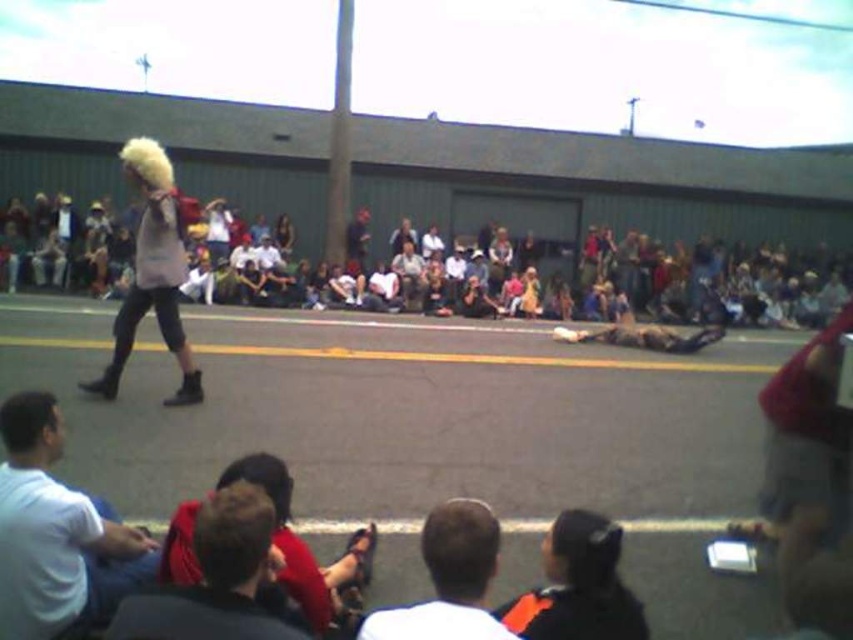
Question: Estimate the real-world distances between objects in this image. Which object is closer to the white cotton shirt at lower left?

Choices:
 (A) fuzzy wig at center
 (B) orange and black jacket at lower center
 (C) fuzzy white wig at left

Answer: (B)

Question: Which point is closer to the camera?

Choices:
 (A) fuzzy wig at center
 (B) red shirt at lower left

Answer: (B)

Question: Does orange and black jacket at lower center appear on the right side of fuzzy white wig at left?

Choices:
 (A) yes
 (B) no

Answer: (A)

Question: In this image, where is light brown fabric crowd at center located relative to fuzzy wig at center?

Choices:
 (A) left
 (B) right

Answer: (B)

Question: Where is white cotton shirt at lower left located in relation to dark brown leather shoes at lower center in the image?

Choices:
 (A) above
 (B) below

Answer: (A)

Question: Which point is farther to the camera?

Choices:
 (A) dark brown leather shoes at lower center
 (B) white cotton shirt at lower left
 (C) light brown fabric crowd at center
 (D) fuzzy white wig at left

Answer: (C)